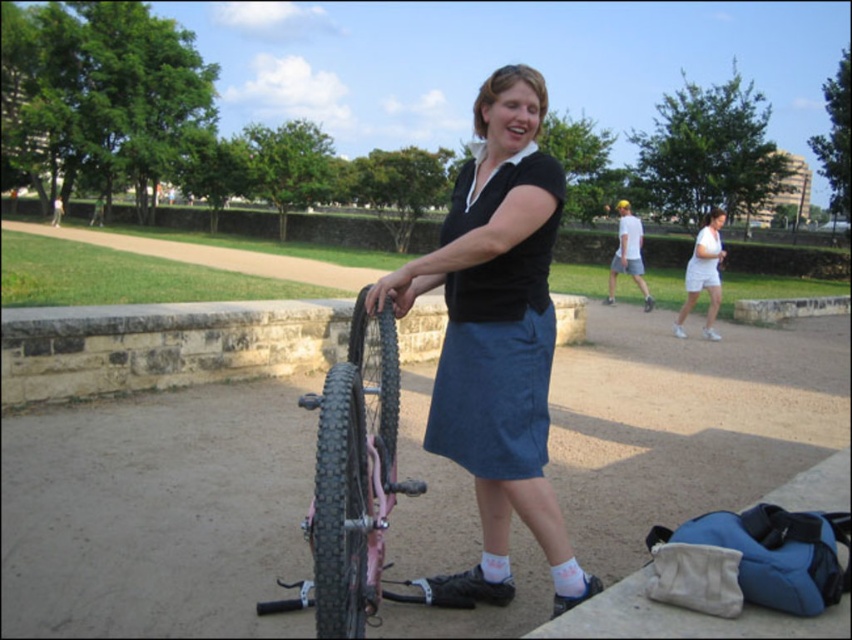
Between matte black shirt at center and white cotton dress at center, which one has more height?

matte black shirt at center

Can you confirm if matte black shirt at center is positioned above white cotton dress at center?

No.

Does point (486, 348) come closer to viewer compared to point (714, 244)?

Yes, it is in front of point (714, 244).

The height and width of the screenshot is (640, 852). What are the coordinates of `matte black shirt at center` in the screenshot? It's located at (x=498, y=333).

Does point (417, 600) lie behind point (709, 268)?

No.

Identify the location of pink matte bicycle at center. This screenshot has width=852, height=640. (354, 483).

The width and height of the screenshot is (852, 640). Describe the element at coordinates (340, 506) in the screenshot. I see `black rubber tire at lower left` at that location.

Does point (338, 572) come closer to viewer compared to point (706, 312)?

Yes, point (338, 572) is closer to viewer.

Which is in front, point (329, 390) or point (712, 308)?

Point (329, 390) is more forward.

The height and width of the screenshot is (640, 852). Identify the location of black rubber tire at lower left. (340, 506).